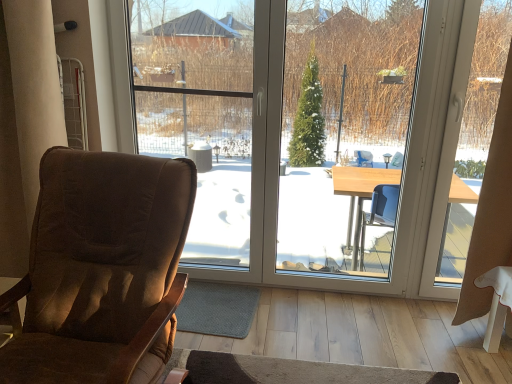
Identify the location of beige fabric curtain at right. (490, 212).

This screenshot has height=384, width=512. What do you see at coordinates (200, 112) in the screenshot? I see `transparent glass window screen at center` at bounding box center [200, 112].

You are a GUI agent. You are given a task and a screenshot of the screen. Output one action in this format:
    pyautogui.click(x=<x>, y=<y>)
    Task: Click on the brown fabric chair at left
    The height and width of the screenshot is (384, 512).
    Given the screenshot: What is the action you would take?
    pyautogui.click(x=102, y=269)

Measure the distance between transparent glass window at center and camera.

A distance of 2.06 meters exists between transparent glass window at center and camera.

This screenshot has width=512, height=384. In order to click on beige fabric curtain at right in this screenshot , I will do `click(490, 212)`.

Is transparent glass window screen at center shorter than beige fabric curtain at right?

Incorrect, the height of transparent glass window screen at center does not fall short of that of beige fabric curtain at right.

Looking at their sizes, would you say transparent glass window screen at center is wider or thinner than beige fabric curtain at right?

Considering their sizes, transparent glass window screen at center looks slimmer than beige fabric curtain at right.

From a real-world perspective, which object rests below the other?

beige fabric curtain at right is physically lower.

From the image's perspective, which is above, transparent glass window screen at center or beige fabric curtain at right?

transparent glass window screen at center is shown above in the image.

Which is in front, brown fabric chair at left or beige fabric curtain at right?

brown fabric chair at left is in front.

Would you say brown fabric chair at left is to the left or to the right of beige fabric curtain at right in the picture?

brown fabric chair at left is to the left of beige fabric curtain at right.

From a real-world perspective, is brown fabric chair at left on beige fabric curtain at right?

Incorrect, from a real-world perspective, brown fabric chair at left is lower than beige fabric curtain at right.

How distant is brown fabric chair at left from beige fabric curtain at right?

They are 5.54 feet apart.

From the picture: Is brown fabric chair at left not within transparent glass window at center?

brown fabric chair at left lies outside transparent glass window at center's area.

Which object is positioned more to the left, brown fabric chair at left or transparent glass window at center?

brown fabric chair at left.

How many degrees apart are the facing directions of brown fabric chair at left and transparent glass window at center?

2.38 degrees.

Does brown fabric chair at left have a lesser width compared to transparent glass window at center?

Incorrect, the width of brown fabric chair at left is not less than that of transparent glass window at center.

Considering the positions of objects transparent glass window screen at center and brown fabric chair at left in the image provided, who is more to the right, transparent glass window screen at center or brown fabric chair at left?

Positioned to the right is transparent glass window screen at center.

Would you consider transparent glass window screen at center to be distant from brown fabric chair at left?

Indeed, transparent glass window screen at center is not near brown fabric chair at left.

In order to click on window screen that is behind the brown fabric chair at left in this screenshot , I will do `click(200, 112)`.

Looking at the image, does transparent glass window screen at center seem bigger or smaller compared to brown fabric chair at left?

Clearly, transparent glass window screen at center is smaller in size than brown fabric chair at left.

From the image's perspective, relative to beige fabric curtain at right, is transparent glass window at center above or below?

transparent glass window at center is above beige fabric curtain at right.

Which is correct: transparent glass window at center is inside beige fabric curtain at right, or outside of it?

transparent glass window at center exists outside the volume of beige fabric curtain at right.

The image size is (512, 384). Identify the location of curtain in front of the transparent glass window at center. [x=490, y=212].

What's the angular difference between transparent glass window at center and beige fabric curtain at right's facing directions?

The angular difference between transparent glass window at center and beige fabric curtain at right is 0.857 degrees.

Are brown fabric chair at left and transparent glass window screen at center making contact?

No, brown fabric chair at left is not next to transparent glass window screen at center.

How far apart are brown fabric chair at left and transparent glass window screen at center?

5.11 feet.

Based on the photo, does brown fabric chair at left have a smaller size compared to transparent glass window screen at center?

No.

Which is correct: beige fabric curtain at right is inside transparent glass window at center, or outside of it?

beige fabric curtain at right cannot be found inside transparent glass window at center.

From a real-world perspective, which is physically below, beige fabric curtain at right or transparent glass window at center?

beige fabric curtain at right is physically lower.

Is beige fabric curtain at right further to camera compared to transparent glass window at center?

No, it is in front of transparent glass window at center.

Between beige fabric curtain at right and transparent glass window at center, which one appears on the left side from the viewer's perspective?

From the viewer's perspective, transparent glass window at center appears more on the left side.

The width and height of the screenshot is (512, 384). What are the coordinates of `curtain on the right of transparent glass window screen at center` in the screenshot? It's located at (490, 212).

Identify the location of chair directly beneath the beige fabric curtain at right (from a real-world perspective). The image size is (512, 384). (102, 269).

Considering their positions, is transparent glass window screen at center positioned closer to transparent glass window at center than beige fabric curtain at right?

Among the two, beige fabric curtain at right is located nearer to transparent glass window at center.

When comparing their distances from transparent glass window screen at center, does transparent glass window at center or beige fabric curtain at right seem further?

beige fabric curtain at right is further to transparent glass window screen at center.

Estimate the real-world distances between objects in this image. Which object is further from transparent glass window at center, brown fabric chair at left or transparent glass window screen at center?

Among the two, brown fabric chair at left is located further to transparent glass window at center.

Which object lies further to the anchor point transparent glass window screen at center, brown fabric chair at left or transparent glass window at center?

brown fabric chair at left is further to transparent glass window screen at center.

Looking at the image, which one is located further to beige fabric curtain at right, transparent glass window screen at center or brown fabric chair at left?

transparent glass window screen at center is positioned further to the anchor beige fabric curtain at right.

Based on their spatial positions, is transparent glass window at center or brown fabric chair at left further from transparent glass window screen at center?

Based on the image, brown fabric chair at left appears to be further to transparent glass window screen at center.

Based on their spatial positions, is beige fabric curtain at right or transparent glass window screen at center further from brown fabric chair at left?

Based on the image, beige fabric curtain at right appears to be further to brown fabric chair at left.

Based on their spatial positions, is transparent glass window at center or beige fabric curtain at right closer to brown fabric chair at left?

Based on the image, transparent glass window at center appears to be nearer to brown fabric chair at left.

Locate an element on the screen. Image resolution: width=512 pixels, height=384 pixels. window between brown fabric chair at left and transparent glass window screen at center along the z-axis is located at coordinates (377, 169).

Where is `window situated between brown fabric chair at left and beige fabric curtain at right from left to right`? window situated between brown fabric chair at left and beige fabric curtain at right from left to right is located at coordinates tap(377, 169).

Identify the location of window screen between brown fabric chair at left and beige fabric curtain at right in the horizontal direction. (200, 112).

Identify the location of window situated between transparent glass window screen at center and beige fabric curtain at right from left to right. (377, 169).